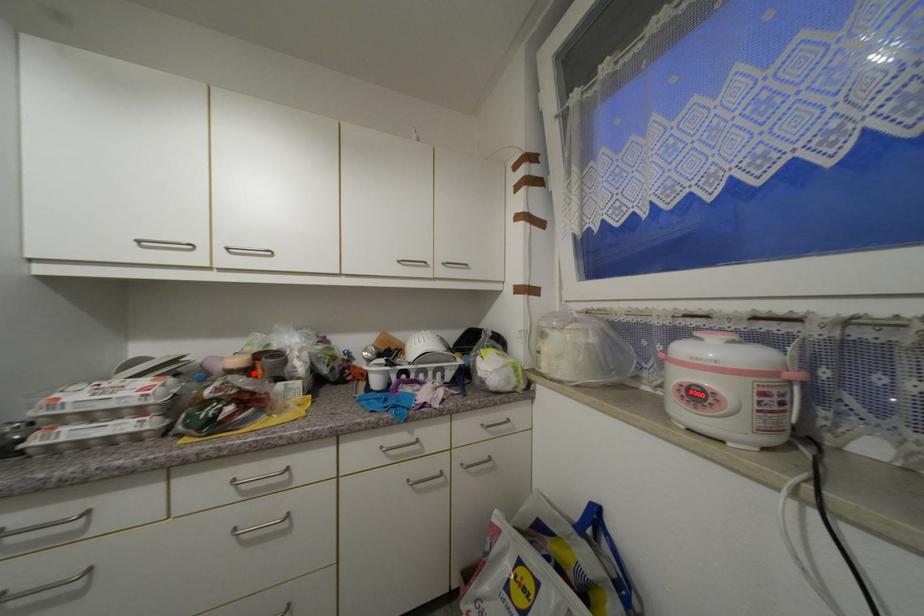
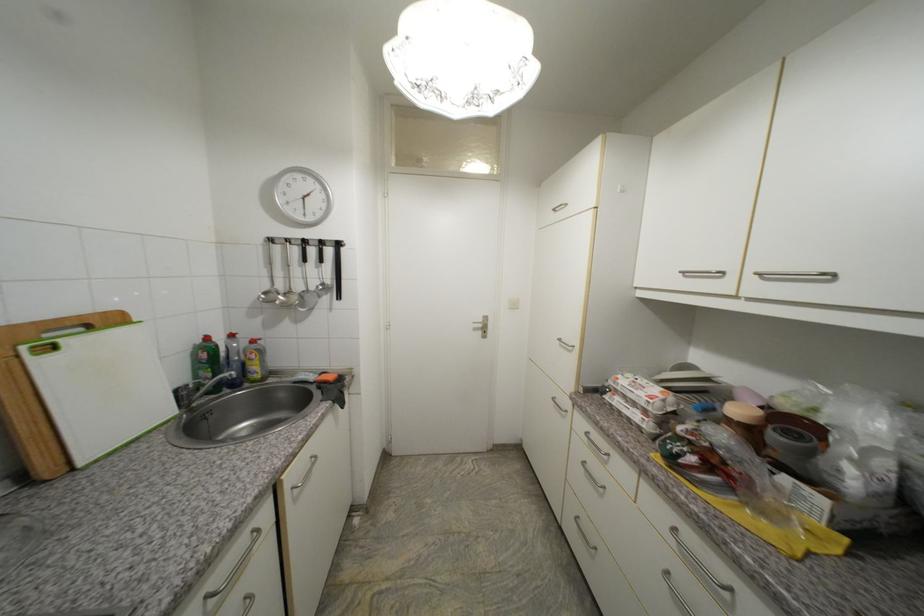
Locate, in the second image, the point that corresponds to the highlighted location in the first image.

(756, 432)